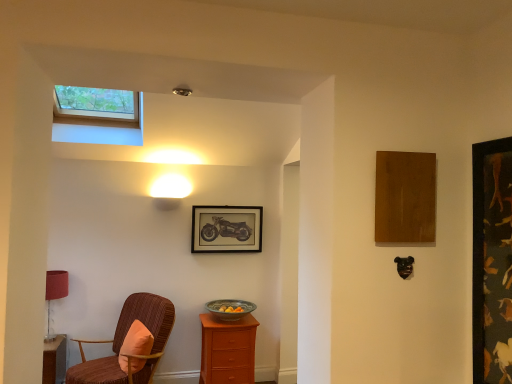
This screenshot has height=384, width=512. What do you see at coordinates (135, 348) in the screenshot?
I see `orange fabric pillow at lower left` at bounding box center [135, 348].

This screenshot has width=512, height=384. Describe the element at coordinates (492, 262) in the screenshot. I see `dark wood picture frame at right, marked as the 1th picture frame in a front-to-back arrangement` at that location.

Where is `velvet brown chair with orange cushion at left`? This screenshot has width=512, height=384. velvet brown chair with orange cushion at left is located at coordinates (123, 340).

Find the location of a particular element. matte red lampshade at left is located at coordinates (55, 293).

Based on their sizes in the image, would you say matte red lampshade at left is bigger or smaller than earthy ceramic bowl at center?

Considering their sizes, matte red lampshade at left takes up more space than earthy ceramic bowl at center.

Which of these two, matte red lampshade at left or earthy ceramic bowl at center, stands taller?

Standing taller between the two is matte red lampshade at left.

Which object is positioned more to the left, matte red lampshade at left or earthy ceramic bowl at center?

From the viewer's perspective, matte red lampshade at left appears more on the left side.

From the picture: From a real-world perspective, is matte red lampshade at left physically below earthy ceramic bowl at center?

Incorrect, from a real-world perspective, matte red lampshade at left is higher than earthy ceramic bowl at center.

Can we say matte red lampshade at left lies outside orange fabric pillow at lower left?

Absolutely, matte red lampshade at left is external to orange fabric pillow at lower left.

Based on their sizes in the image, would you say matte red lampshade at left is bigger or smaller than orange fabric pillow at lower left?

In the image, matte red lampshade at left appears to be larger than orange fabric pillow at lower left.

From a real-world perspective, is matte red lampshade at left physically above orange fabric pillow at lower left?

Yes, from a real-world perspective, matte red lampshade at left is on top of orange fabric pillow at lower left.

Is wooden nightstand at center situated inside orange fabric pillow at lower left or outside?

wooden nightstand at center exists outside the volume of orange fabric pillow at lower left.

From the image's perspective, is wooden nightstand at center beneath orange fabric pillow at lower left?

Correct, wooden nightstand at center appears lower than orange fabric pillow at lower left in the image.

Does wooden nightstand at center have a greater height compared to orange fabric pillow at lower left?

Indeed, wooden nightstand at center has a greater height compared to orange fabric pillow at lower left.

Would you say wooden nightstand at center is to the left or to the right of orange fabric pillow at lower left in the picture?

Based on their positions, wooden nightstand at center is located to the right of orange fabric pillow at lower left.

Can you confirm if orange fabric pillow at lower left is thinner than matte red lampshade at left?

Correct, the width of orange fabric pillow at lower left is less than that of matte red lampshade at left.

Would you say orange fabric pillow at lower left is outside matte red lampshade at left?

Absolutely, orange fabric pillow at lower left is external to matte red lampshade at left.

Is orange fabric pillow at lower left smaller than matte red lampshade at left?

Yes.

In the scene shown: Is orange fabric pillow at lower left next to matte red lampshade at left?

No, orange fabric pillow at lower left is not in contact with matte red lampshade at left.

Between wooden nightstand at center and earthy ceramic bowl at center, which one has more height?

wooden nightstand at center.

Is wooden nightstand at center at the right side of earthy ceramic bowl at center?

In fact, wooden nightstand at center is to the left of earthy ceramic bowl at center.

From a real-world perspective, is wooden nightstand at center located beneath earthy ceramic bowl at center?

Yes, from a real-world perspective, wooden nightstand at center is below earthy ceramic bowl at center.

At what (x,y) coordinates should I click in order to perform the action: click on bowl located above the wooden nightstand at center (from the image's perspective). Please return your answer as a coordinate pair (x, y). The height and width of the screenshot is (384, 512). Looking at the image, I should click on (229, 309).

Which object is positioned more to the right, earthy ceramic bowl at center or wooden nightstand at center?

earthy ceramic bowl at center.

Is earthy ceramic bowl at center further to camera compared to wooden nightstand at center?

Yes, the depth of earthy ceramic bowl at center is greater than that of wooden nightstand at center.

Does earthy ceramic bowl at center contain wooden nightstand at center?

No, wooden nightstand at center is not inside earthy ceramic bowl at center.

Identify the location of nightstand that is below the earthy ceramic bowl at center (from the image's perspective). This screenshot has height=384, width=512. (228, 350).

Measure the distance from orange fabric pillow at lower left to velvet brown chair with orange cushion at left.

They are 17.12 centimeters apart.

Where is `chair in front of the orange fabric pillow at lower left`? The image size is (512, 384). chair in front of the orange fabric pillow at lower left is located at coordinates (123, 340).

From the image's perspective, between orange fabric pillow at lower left and velvet brown chair with orange cushion at left, who is located below?

velvet brown chair with orange cushion at left, from the image's perspective.

Can you tell me how much orange fabric pillow at lower left and velvet brown chair with orange cushion at left differ in facing direction?

orange fabric pillow at lower left and velvet brown chair with orange cushion at left are facing 24.6 degrees away from each other.

You are a GUI agent. You are given a task and a screenshot of the screen. Output one action in this format:
    pyautogui.click(x=<x>, y=<y>)
    Task: Click on the lamp located in front of the earthy ceramic bowl at center
    The image size is (512, 384).
    Given the screenshot: What is the action you would take?
    pyautogui.click(x=55, y=293)

The height and width of the screenshot is (384, 512). Find the location of `lamp on the left of the orange fabric pillow at lower left`. lamp on the left of the orange fabric pillow at lower left is located at coordinates (55, 293).

Based on their spatial positions, is velvet brown chair with orange cushion at left or dark wood picture frame at right, the second picture frame when ordered from left to right, further from earthy ceramic bowl at center?

Among the two, dark wood picture frame at right, the second picture frame when ordered from left to right, is located further to earthy ceramic bowl at center.

Looking at this image, estimate the real-world distances between objects in this image. Which object is further from wooden nightstand at center, dark wood picture frame at right, acting as the 2th picture frame starting from the back, or earthy ceramic bowl at center?

dark wood picture frame at right, acting as the 2th picture frame starting from the back.

Looking at the image, which one is located further to matte black motorcycle at center, the 1th picture frame when ordered from back to front, wooden nightstand at center or matte red lampshade at left?

matte red lampshade at left lies further to matte black motorcycle at center, the 1th picture frame when ordered from back to front, than the other object.

Based on the photo, which object lies further to the anchor point velvet brown chair with orange cushion at left, earthy ceramic bowl at center or orange fabric pillow at lower left?

The object further to velvet brown chair with orange cushion at left is earthy ceramic bowl at center.

Which object lies further to the anchor point velvet brown chair with orange cushion at left, wooden nightstand at center or orange fabric pillow at lower left?

Based on the image, wooden nightstand at center appears to be further to velvet brown chair with orange cushion at left.

Which object lies nearer to the anchor point dark wood picture frame at right, acting as the 2th picture frame starting from the back, matte black motorcycle at center, which appears as the first picture frame when viewed from the left, or orange fabric pillow at lower left?

orange fabric pillow at lower left.

Which object lies nearer to the anchor point matte red lampshade at left, velvet brown chair with orange cushion at left or dark wood picture frame at right, acting as the 2th picture frame starting from the back?

The object closer to matte red lampshade at left is velvet brown chair with orange cushion at left.

Based on the photo, estimate the real-world distances between objects in this image. Which object is further from matte red lampshade at left, orange fabric pillow at lower left or matte black motorcycle at center, marked as the second picture frame in a right-to-left arrangement?

matte black motorcycle at center, marked as the second picture frame in a right-to-left arrangement.

The image size is (512, 384). I want to click on pillow between dark wood picture frame at right, acting as the 2th picture frame starting from the back, and matte black motorcycle at center, acting as the second picture frame starting from the front, from front to back, so click(x=135, y=348).

Locate an element on the screen. Image resolution: width=512 pixels, height=384 pixels. chair located between matte red lampshade at left and earthy ceramic bowl at center in the left-right direction is located at coordinates (x=123, y=340).

The height and width of the screenshot is (384, 512). I want to click on pillow between matte red lampshade at left and wooden nightstand at center from left to right, so click(x=135, y=348).

The width and height of the screenshot is (512, 384). Find the location of `bowl between matte black motorcycle at center, which appears as the first picture frame when viewed from the left, and orange fabric pillow at lower left from top to bottom`. bowl between matte black motorcycle at center, which appears as the first picture frame when viewed from the left, and orange fabric pillow at lower left from top to bottom is located at coordinates (229, 309).